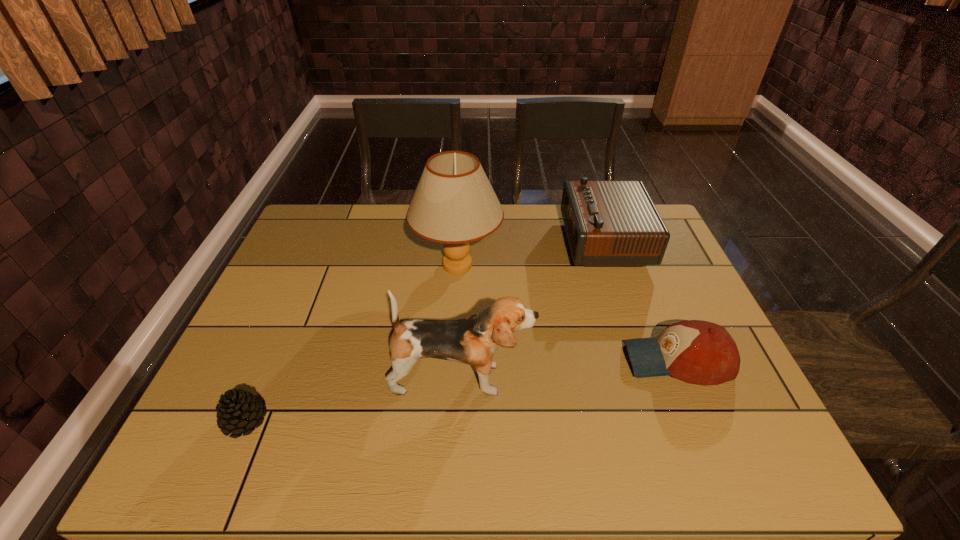
Locate an element on the screen. This screenshot has height=540, width=960. object that is positioned at the near left corner is located at coordinates (237, 411).

Image resolution: width=960 pixels, height=540 pixels. What are the coordinates of `object situated at the far right corner` in the screenshot? It's located at (608, 223).

Locate an element on the screen. The height and width of the screenshot is (540, 960). free space at the far edge of the desktop is located at coordinates (533, 226).

In the image, there is a desktop. Identify the location of vacant space at the left edge. (294, 280).

I want to click on vacant space at the right edge of the desktop, so click(653, 266).

Where is `vacant space at the near right corner of the desktop`? vacant space at the near right corner of the desktop is located at coordinates (758, 438).

Identify the location of vacant area between the pinecone and the puppy. The width and height of the screenshot is (960, 540). (353, 400).

You are a GUI agent. You are given a task and a screenshot of the screen. Output one action in this format:
    pyautogui.click(x=<x>, y=<y>)
    Task: Click on the free space between the second tallest object and the nearest object
    
    Given the screenshot: What is the action you would take?
    pyautogui.click(x=353, y=400)

The width and height of the screenshot is (960, 540). What are the coordinates of `vacant space in between the baseball cap and the pinecone` in the screenshot? It's located at (461, 390).

Locate an element on the screen. The height and width of the screenshot is (540, 960). free space between the tallest object and the nearest object is located at coordinates (351, 343).